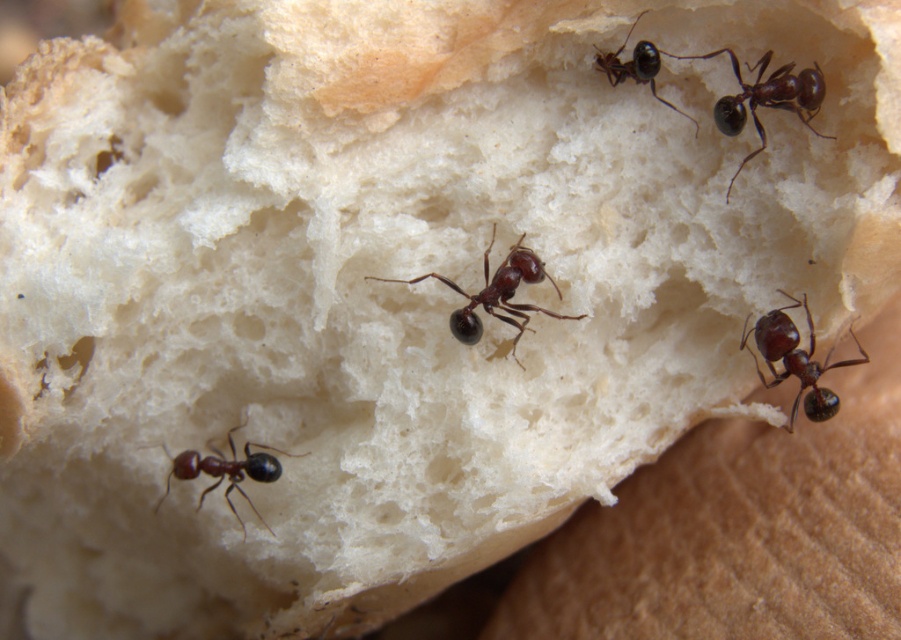
Question: Among these points, which one is farthest from the camera?

Choices:
 (A) (517, 333)
 (B) (231, 444)

Answer: (B)

Question: Which point is farther to the camera?

Choices:
 (A) (757, 339)
 (B) (255, 458)
 (C) (658, 60)
 (D) (761, 90)

Answer: (B)

Question: Is shiny dark brown ant at center to the right of shiny black ant at lower left from the viewer's perspective?

Choices:
 (A) no
 (B) yes

Answer: (B)

Question: Can you confirm if shiny brown ant at center-right is positioned below shiny dark brown ant at upper center?

Choices:
 (A) yes
 (B) no

Answer: (A)

Question: From the image, what is the correct spatial relationship of shiny brown ant at center-right in relation to shiny dark brown ant at upper center?

Choices:
 (A) above
 (B) below

Answer: (B)

Question: Estimate the real-world distances between objects in this image. Which object is closer to the shiny brown ant at center-right?

Choices:
 (A) shiny dark brown ant at upper right
 (B) shiny black ant at lower left

Answer: (A)